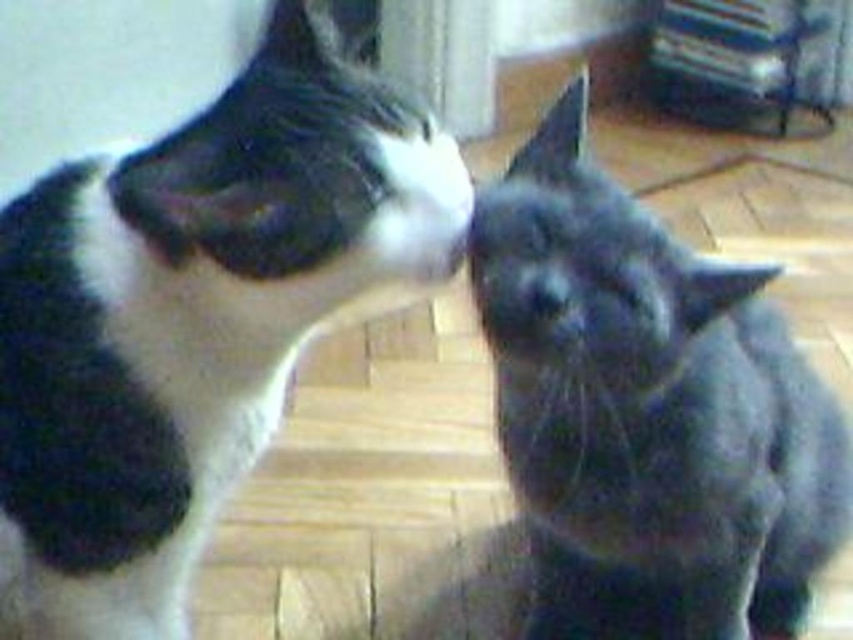
Question: Which of the following is the closest to the observer?

Choices:
 (A) (108, 100)
 (B) (537, 314)

Answer: (B)

Question: Which point appears farthest from the camera in this image?

Choices:
 (A) (527, 176)
 (B) (86, 40)
 (C) (264, 440)

Answer: (B)

Question: Is soft fur cat at upper left smaller than gray matte nose at center?

Choices:
 (A) yes
 (B) no

Answer: (B)

Question: Is gray fluffy cat at right bigger than soft fur cat at upper left?

Choices:
 (A) yes
 (B) no

Answer: (A)

Question: Considering the real-world distances, which object is farthest from the soft fur cat at upper left?

Choices:
 (A) gray matte nose at center
 (B) gray fluffy cat at right
 (C) black and white fur cat at left

Answer: (A)

Question: Can you confirm if soft fur cat at upper left is positioned to the left of gray matte nose at center?

Choices:
 (A) yes
 (B) no

Answer: (A)